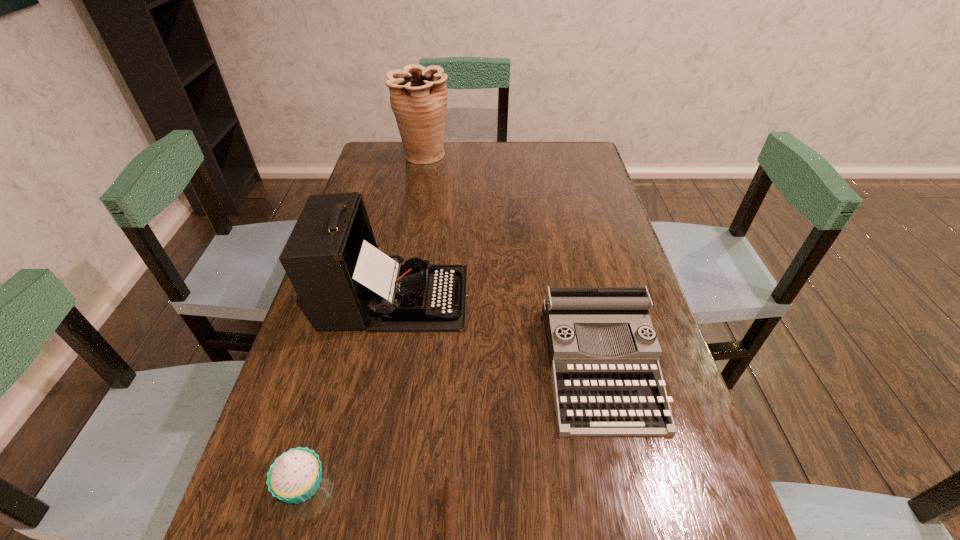
Locate an element on the screen. The image size is (960, 540). free spot between the cupcake and the left typewriter is located at coordinates (348, 390).

At what (x,y) coordinates should I click in order to perform the action: click on free space that is in between the left typewriter and the farthest object. Please return your answer as a coordinate pair (x, y). The height and width of the screenshot is (540, 960). Looking at the image, I should click on (409, 226).

Find the location of a particular element. This screenshot has height=540, width=960. vacant space in between the taller typewriter and the cupcake is located at coordinates (348, 390).

Choose which object is the third nearest neighbor to the rightmost object. Please provide its 2D coordinates. Your answer should be formatted as a tuple, i.e. [(x, y)], where the tuple contains the x and y coordinates of a point satisfying the conditions above.

[(295, 476)]

Choose which object is the fourth nearest neighbor to the shortest object. Please provide its 2D coordinates. Your answer should be formatted as a tuple, i.e. [(x, y)], where the tuple contains the x and y coordinates of a point satisfying the conditions above.

[(418, 96)]

Identify the location of free point that satisfies the following two spatial constraints: 1. on the back side of the cupcake; 2. on the right side of the farthest object. (394, 156).

Locate an element on the screen. This screenshot has width=960, height=540. blank space that satisfies the following two spatial constraints: 1. on the front side of the farthest object; 2. inside the open case of the left typewriter is located at coordinates (397, 297).